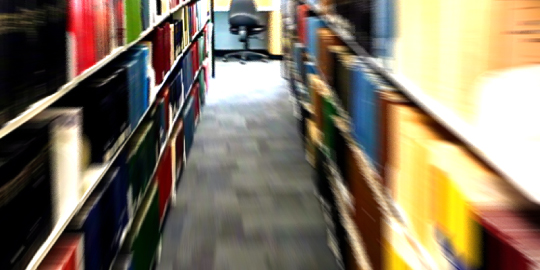
Locate an element on the screen. The height and width of the screenshot is (270, 540). chair is located at coordinates (237, 18).